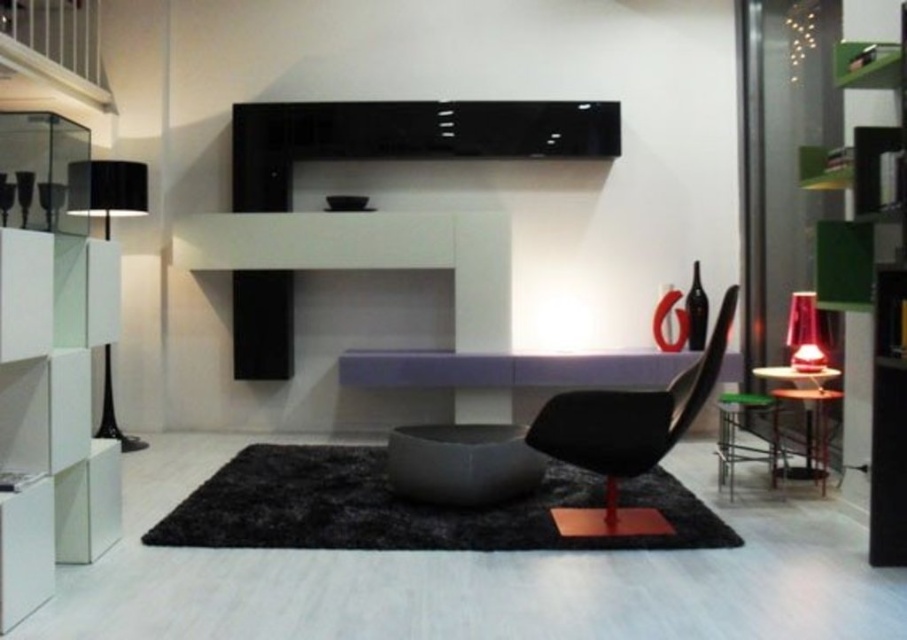
Question: Does black matte floor lamp at left appear under translucent red glass lampshade at right?

Choices:
 (A) yes
 (B) no

Answer: (B)

Question: Among these points, which one is nearest to the camera?

Choices:
 (A) (823, 413)
 (B) (90, 212)

Answer: (A)

Question: Does green matte bookshelf at right have a greater width compared to metallic black side table at lower right?

Choices:
 (A) no
 (B) yes

Answer: (A)

Question: Which object is positioned closest to the green matte bookshelf at right?

Choices:
 (A) translucent red glass lampshade at right
 (B) black matte armchair at center
 (C) metallic black side table at lower right
 (D) black matte floor lamp at left

Answer: (C)

Question: Estimate the real-world distances between objects in this image. Which object is farther from the translucent red glass lampshade at right?

Choices:
 (A) metallic black side table at lower right
 (B) green matte bookshelf at right
 (C) black matte floor lamp at left
 (D) black matte armchair at center

Answer: (C)

Question: Is green matte bookshelf at right positioned behind metallic black side table at lower right?

Choices:
 (A) yes
 (B) no

Answer: (B)